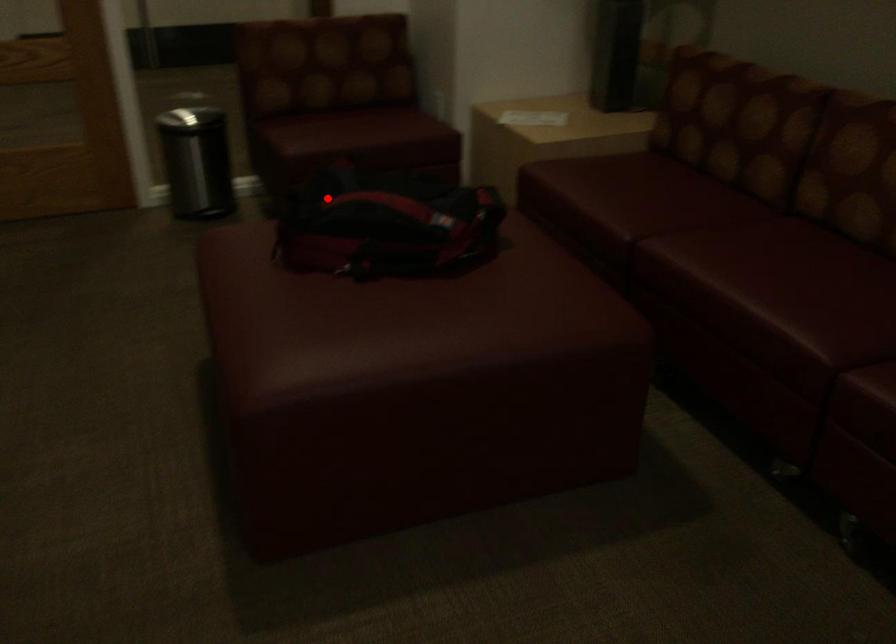
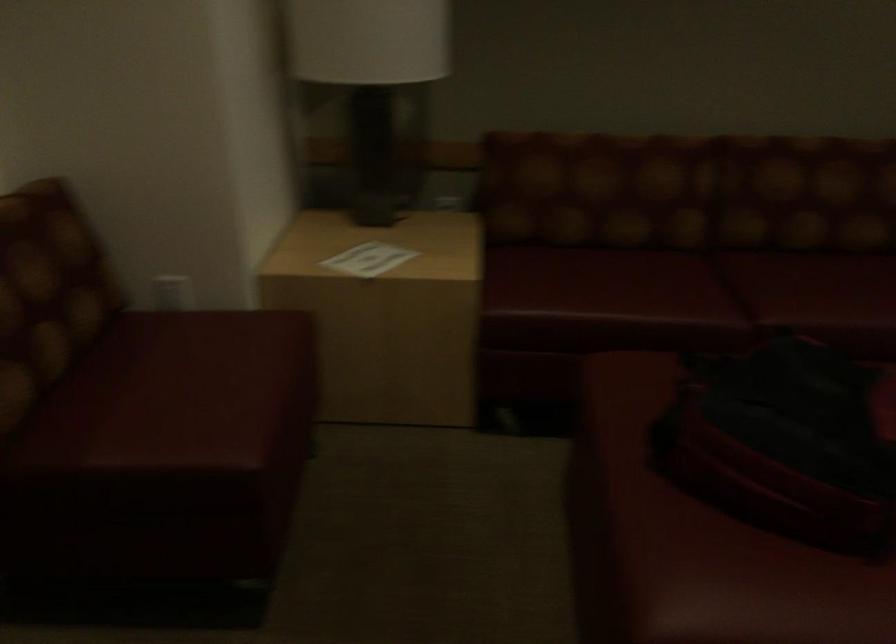
Question: I am providing you with two images of the same scene from different viewpoints. In image1, a red point is highlighted. Considering the same 3D point in image2, which of the following is correct?

Choices:
 (A) It is closer
 (B) It is farther

Answer: (A)